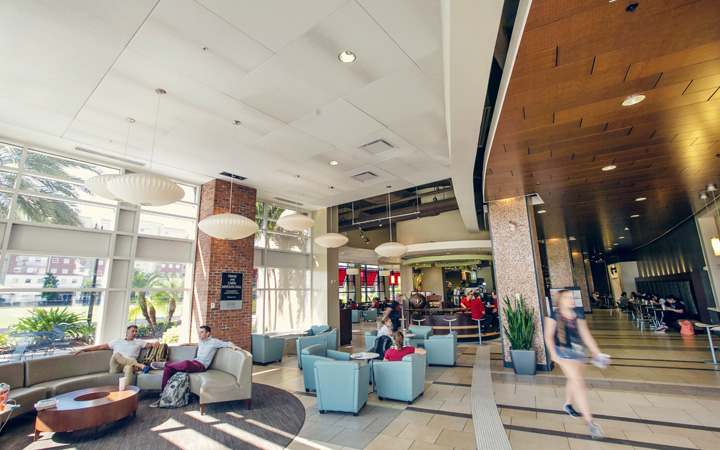
Where is `chair`? The width and height of the screenshot is (720, 450). chair is located at coordinates (330, 367), (306, 356), (312, 344), (435, 340).